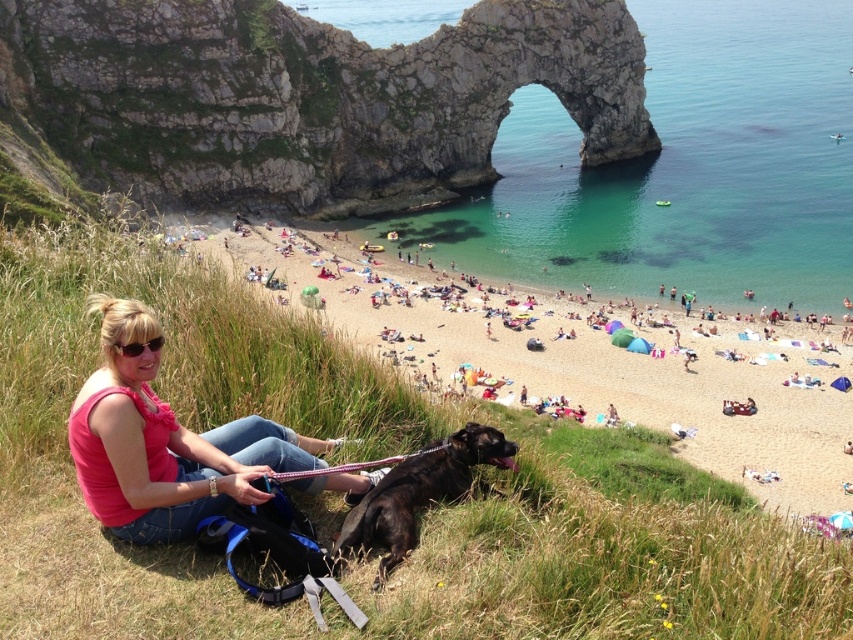
Question: Estimate the real-world distances between objects in this image. Which object is farther from the pink fabric at lower left?

Choices:
 (A) shiny black dog at lower center
 (B) beige sand beach at lower center

Answer: (B)

Question: Considering the relative positions of pink fabric at lower left and shiny black dog at lower center in the image provided, where is pink fabric at lower left located with respect to shiny black dog at lower center?

Choices:
 (A) above
 (B) below

Answer: (A)

Question: Is pink fabric at lower left thinner than shiny black dog at lower center?

Choices:
 (A) no
 (B) yes

Answer: (A)

Question: Which point appears farthest from the camera in this image?

Choices:
 (A) (450, 332)
 (B) (457, 429)
 (C) (386, 189)
 (D) (285, 460)

Answer: (C)

Question: Considering the relative positions of rugged stone arch at center and pink fabric at lower left in the image provided, where is rugged stone arch at center located with respect to pink fabric at lower left?

Choices:
 (A) left
 (B) right

Answer: (B)

Question: Based on their relative distances, which object is farther from the rugged stone arch at center?

Choices:
 (A) beige sand beach at lower center
 (B) shiny black dog at lower center
 (C) pink fabric at lower left

Answer: (B)